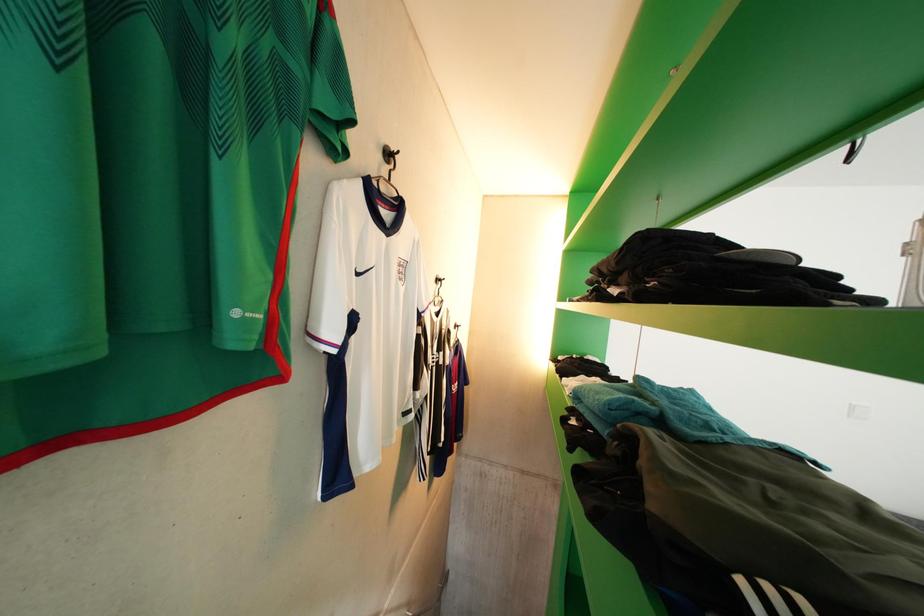
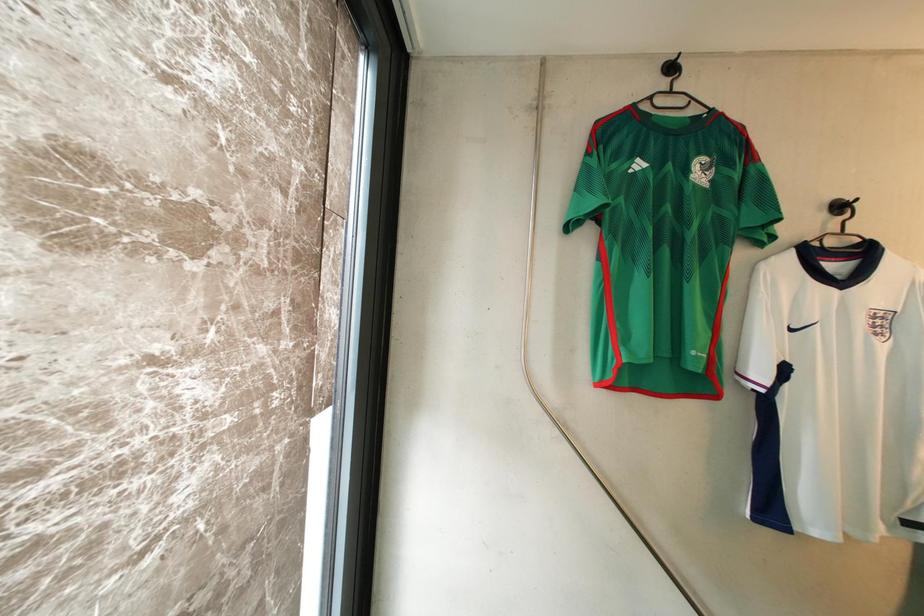
Question: The camera is either moving clockwise (left) or counter-clockwise (right) around the object. The first image is from the beginning of the video and the second image is from the end. Is the camera moving left or right when shooting the video?

Choices:
 (A) Left
 (B) Right

Answer: (B)